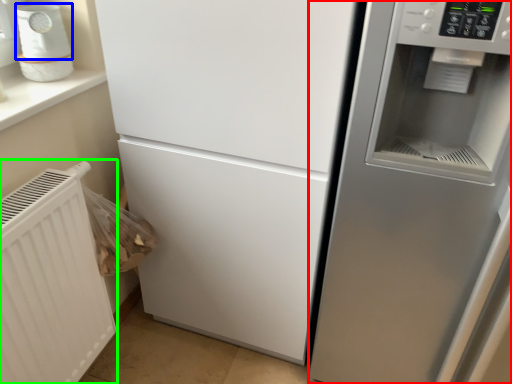
Question: Estimate the real-world distances between objects in this image. Which object is closer to fridge (highlighted by a red box), appliance (highlighted by a blue box) or radiator (highlighted by a green box)?

Choices:
 (A) appliance
 (B) radiator

Answer: (B)